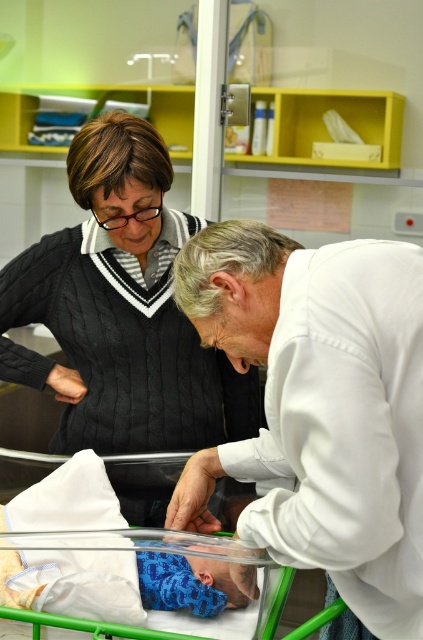
Can you confirm if white smooth coat at center is smaller than black cable-knit sweater at upper left?

Yes, white smooth coat at center is smaller than black cable-knit sweater at upper left.

Consider the image. Is the position of white smooth coat at center less distant than that of black cable-knit sweater at upper left?

Yes, white smooth coat at center is closer to the viewer.

Does point (255, 509) lie in front of point (150, 387)?

Yes, point (255, 509) is closer to viewer.

Where is `white smooth coat at center`? white smooth coat at center is located at coordinates (320, 406).

Does white smooth coat at center have a greater height compared to blue knitted fabric at center?

Indeed, white smooth coat at center has a greater height compared to blue knitted fabric at center.

Which is above, white smooth coat at center or blue knitted fabric at center?

white smooth coat at center

Does point (296, 420) come closer to viewer compared to point (222, 604)?

Yes, it is in front of point (222, 604).

Locate an element on the screen. Image resolution: width=423 pixels, height=640 pixels. white smooth coat at center is located at coordinates (320, 406).

Which is more to the left, black cable-knit sweater at upper left or blue knitted fabric at center?

black cable-knit sweater at upper left

Can you confirm if black cable-knit sweater at upper left is bigger than blue knitted fabric at center?

Yes, black cable-knit sweater at upper left is bigger than blue knitted fabric at center.

The image size is (423, 640). In order to click on black cable-knit sweater at upper left in this screenshot , I will do `click(120, 308)`.